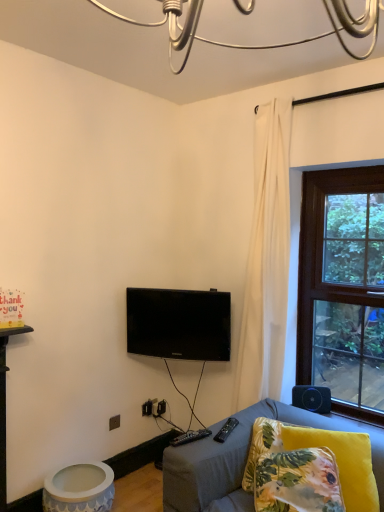
Question: From the image's perspective, is matte white ceramic table at lower left under black fabric speaker at lower right?

Choices:
 (A) yes
 (B) no

Answer: (A)

Question: Could you tell me if matte white ceramic table at lower left is facing black fabric speaker at lower right?

Choices:
 (A) yes
 (B) no

Answer: (B)

Question: Considering the relative sizes of matte white ceramic table at lower left and black fabric speaker at lower right in the image provided, is matte white ceramic table at lower left wider than black fabric speaker at lower right?

Choices:
 (A) yes
 (B) no

Answer: (A)

Question: Considering the relative positions of matte white ceramic table at lower left and black fabric speaker at lower right in the image provided, is matte white ceramic table at lower left to the right of black fabric speaker at lower right from the viewer's perspective?

Choices:
 (A) no
 (B) yes

Answer: (A)

Question: From a real-world perspective, is matte white ceramic table at lower left physically below black fabric speaker at lower right?

Choices:
 (A) yes
 (B) no

Answer: (A)

Question: From a real-world perspective, is matte white ceramic table at lower left located higher than black fabric speaker at lower right?

Choices:
 (A) no
 (B) yes

Answer: (A)

Question: Is black glossy tv at center at the left side of black fabric speaker at lower right?

Choices:
 (A) yes
 (B) no

Answer: (A)

Question: Is black glossy tv at center oriented towards black fabric speaker at lower right?

Choices:
 (A) no
 (B) yes

Answer: (A)

Question: Is black glossy tv at center wider than black fabric speaker at lower right?

Choices:
 (A) no
 (B) yes

Answer: (B)

Question: Considering the relative sizes of black glossy tv at center and black fabric speaker at lower right in the image provided, is black glossy tv at center thinner than black fabric speaker at lower right?

Choices:
 (A) yes
 (B) no

Answer: (B)

Question: Can you confirm if black glossy tv at center is taller than black fabric speaker at lower right?

Choices:
 (A) yes
 (B) no

Answer: (A)

Question: Is black glossy tv at center facing away from black fabric speaker at lower right?

Choices:
 (A) yes
 (B) no

Answer: (B)

Question: Does black fabric speaker at lower right have a greater width compared to black plastic remote at lower center, positioned as the first remote in right-to-left order?

Choices:
 (A) no
 (B) yes

Answer: (A)